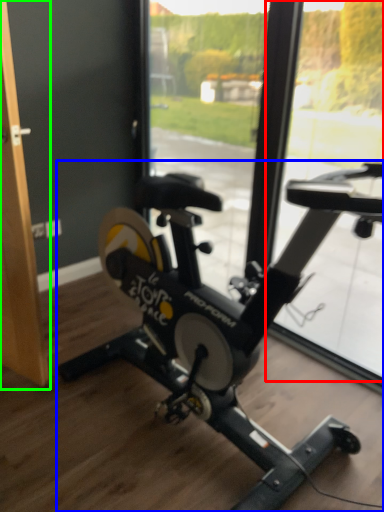
Question: Based on their relative distances, which object is nearer to window screen (highlighted by a red box)? Choose from stationary bicycle (highlighted by a blue box) and screen door (highlighted by a green box).

Choices:
 (A) stationary bicycle
 (B) screen door

Answer: (A)